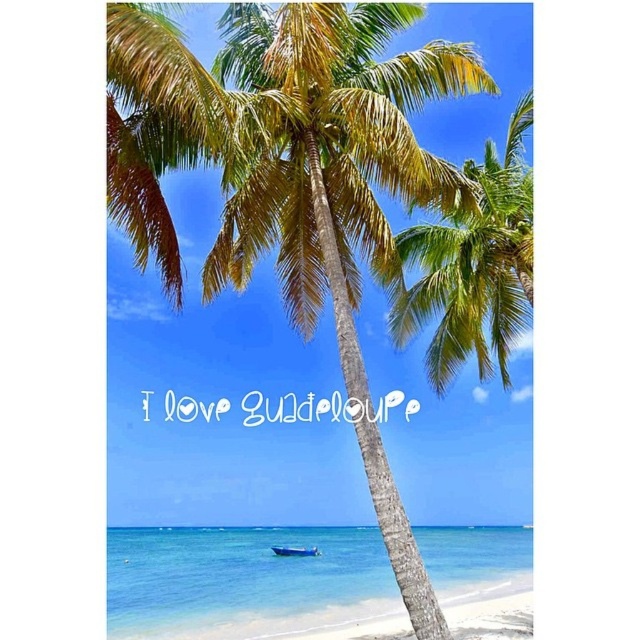
Which is above, green leafy coconut tree at center or blue plastic boat at lower center?

green leafy coconut tree at center

Between point (248, 406) and point (291, 550), which one is positioned behind?

The point (248, 406) is more distant.

Which is in front, point (429, 106) or point (310, 550)?

Positioned in front is point (429, 106).

Where is `green leafy coconut tree at center`? green leafy coconut tree at center is located at coordinates (228, 442).